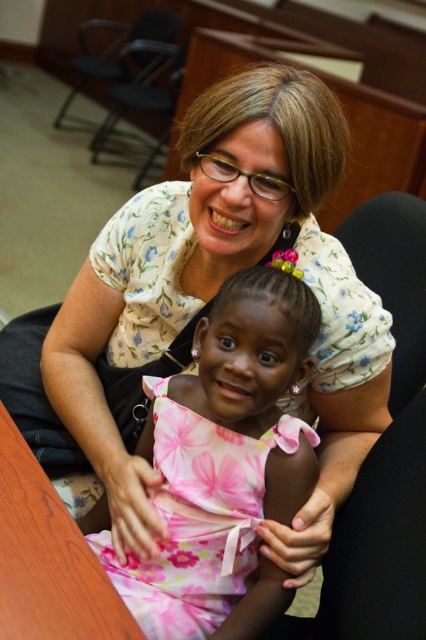
Question: Among these points, which one is farthest from the camera?

Choices:
 (A) (207, 483)
 (B) (48, 541)

Answer: (A)

Question: Does pink floral fabric dress at center appear on the left side of wooden table at lower left?

Choices:
 (A) yes
 (B) no

Answer: (B)

Question: Does pink floral fabric dress at center have a larger size compared to wooden table at lower left?

Choices:
 (A) no
 (B) yes

Answer: (B)

Question: Does pink floral fabric dress at center appear on the right side of wooden table at lower left?

Choices:
 (A) yes
 (B) no

Answer: (A)